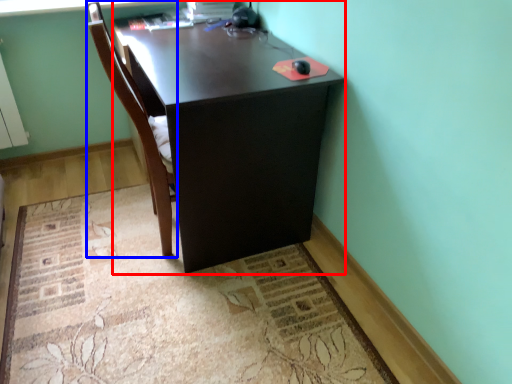
Question: Which object is further to the camera taking this photo, desk (highlighted by a red box) or chair (highlighted by a blue box)?

Choices:
 (A) desk
 (B) chair

Answer: (A)